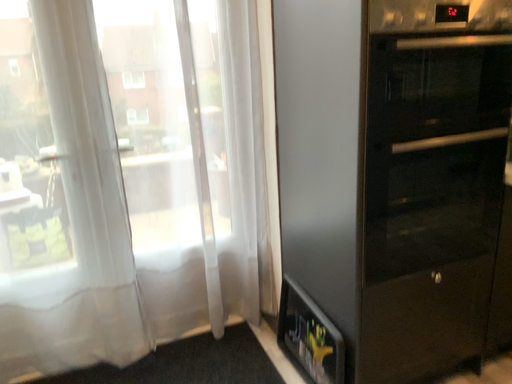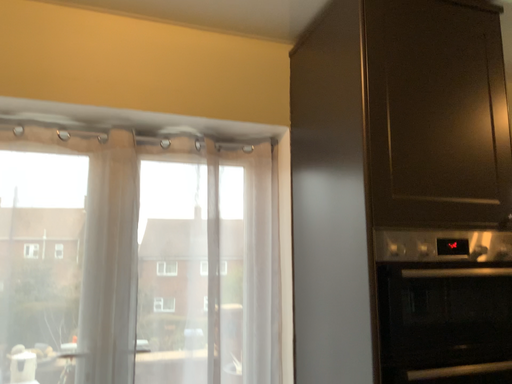
Question: Which way did the camera rotate in the video?

Choices:
 (A) rotated downward
 (B) rotated upward

Answer: (B)